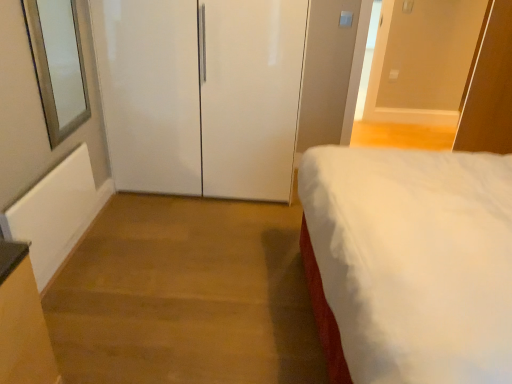
Question: Does white glossy door at center, the 1th door positioned from the left, come in front of white glossy door at upper right, the first door when ordered from right to left?

Choices:
 (A) no
 (B) yes

Answer: (B)

Question: Does white glossy door at center, the 1th door positioned from the left, have a greater height compared to white glossy door at upper right, the first door when ordered from right to left?

Choices:
 (A) no
 (B) yes

Answer: (B)

Question: Does white glossy door at center, the 1th door positioned from the left, have a lesser width compared to white glossy door at upper right, the first door when ordered from right to left?

Choices:
 (A) yes
 (B) no

Answer: (B)

Question: Is white glossy door at center, the 1th door positioned from the left, next to white glossy door at upper right, the first door when ordered from right to left, and touching it?

Choices:
 (A) yes
 (B) no

Answer: (B)

Question: Is the depth of white glossy door at center, the 1th door positioned from the left, greater than that of white glossy door at upper right, the 2th door viewed from the left?

Choices:
 (A) yes
 (B) no

Answer: (B)

Question: Looking at their shapes, would you say white glossy door at center, which is the second door in right-to-left order, is wider or thinner than white soft bed at right?

Choices:
 (A) wide
 (B) thin

Answer: (B)

Question: Is white glossy door at center, which is the second door in right-to-left order, inside the boundaries of white soft bed at right, or outside?

Choices:
 (A) outside
 (B) inside

Answer: (A)

Question: Based on their sizes in the image, would you say white glossy door at center, the 1th door positioned from the left, is bigger or smaller than white soft bed at right?

Choices:
 (A) small
 (B) big

Answer: (A)

Question: From a real-world perspective, is white glossy door at center, which is the second door in right-to-left order, physically located above or below white soft bed at right?

Choices:
 (A) above
 (B) below

Answer: (B)

Question: From a real-world perspective, is white soft bed at right positioned above or below white glossy door at upper right, the 2th door viewed from the left?

Choices:
 (A) above
 (B) below

Answer: (B)

Question: From the image's perspective, is white soft bed at right above or below white glossy door at upper right, the first door when ordered from right to left?

Choices:
 (A) below
 (B) above

Answer: (A)

Question: In terms of size, does white soft bed at right appear bigger or smaller than white glossy door at upper right, the first door when ordered from right to left?

Choices:
 (A) big
 (B) small

Answer: (A)

Question: Considering the positions of white soft bed at right and white glossy door at upper right, the first door when ordered from right to left, in the image, is white soft bed at right taller or shorter than white glossy door at upper right, the first door when ordered from right to left,?

Choices:
 (A) short
 (B) tall

Answer: (B)

Question: Is white soft bed at right to the left or to the right of white glossy door at center, which is the second door in right-to-left order, in the image?

Choices:
 (A) left
 (B) right

Answer: (B)

Question: Looking at the image, does white soft bed at right seem bigger or smaller compared to white glossy door at center, which is the second door in right-to-left order?

Choices:
 (A) small
 (B) big

Answer: (B)